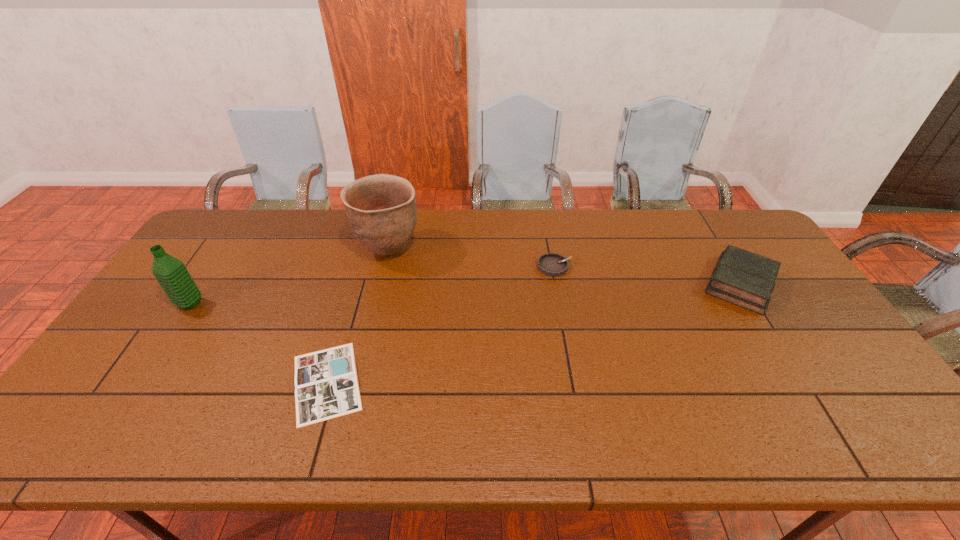
Locate an element on the screen. pottery is located at coordinates (381, 209).

I want to click on water bottle, so click(x=172, y=275).

The width and height of the screenshot is (960, 540). In order to click on the taller book in this screenshot , I will do tap(743, 278).

This screenshot has width=960, height=540. I want to click on the right book, so click(743, 278).

Find the location of `the second shortest object`. the second shortest object is located at coordinates (552, 264).

Find the location of a particular element. The image size is (960, 540). ashtray is located at coordinates (552, 264).

Locate an element on the screen. The height and width of the screenshot is (540, 960). the shorter book is located at coordinates (326, 384).

Where is `the nearer book`? This screenshot has height=540, width=960. the nearer book is located at coordinates (326, 384).

The image size is (960, 540). Find the location of `free space located 0.350m on the front of the pottery`. free space located 0.350m on the front of the pottery is located at coordinates (362, 366).

Identify the location of free space located 0.140m on the right of the water bottle. (251, 304).